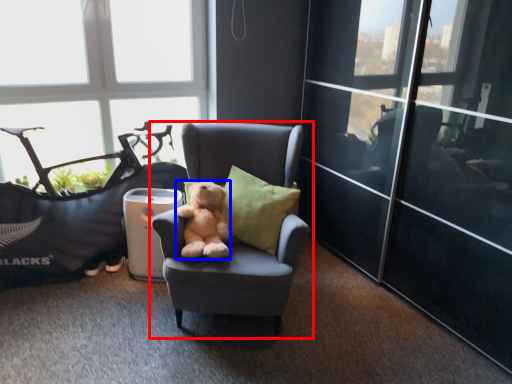
Question: Which object is further to the camera taking this photo, chair (highlighted by a red box) or teddy bear (highlighted by a blue box)?

Choices:
 (A) chair
 (B) teddy bear

Answer: (B)